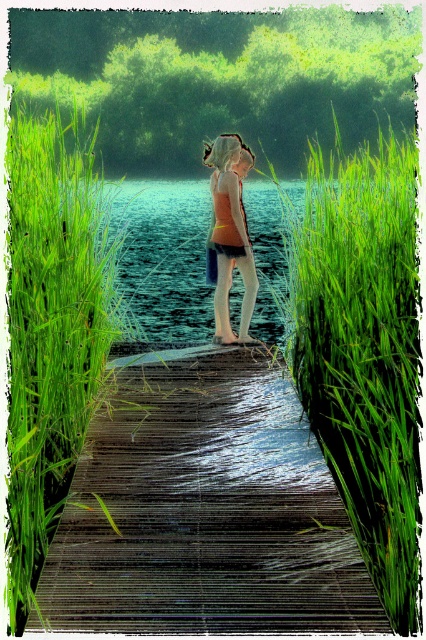
Who is more forward, [360,502] or [40,380]?

Point [40,380]

Who is shorter, green leafy grass at center or green grass at left?

green leafy grass at center

Is point (345, 324) behind point (40, 529)?

Yes, point (345, 324) is farther from viewer.

Locate an element on the screen. This screenshot has width=426, height=640. green leafy grass at center is located at coordinates (362, 348).

Does wooden dock at center have a smaller size compared to green leafy grass at center?

Correct, wooden dock at center occupies less space than green leafy grass at center.

Does wooden dock at center appear over green leafy grass at center?

No, wooden dock at center is not above green leafy grass at center.

Which is behind, point (71, 588) or point (365, 497)?

Point (365, 497)

Find the location of a particular element. wooden dock at center is located at coordinates (203, 509).

Who is shorter, wooden dock at center or matte orange tank top at center?

wooden dock at center

Is wooden dock at center above matte orange tank top at center?

No.

Is point (118, 605) closer to viewer compared to point (241, 182)?

Yes, point (118, 605) is closer to viewer.

Find the location of `wooden dock at center`. wooden dock at center is located at coordinates (203, 509).